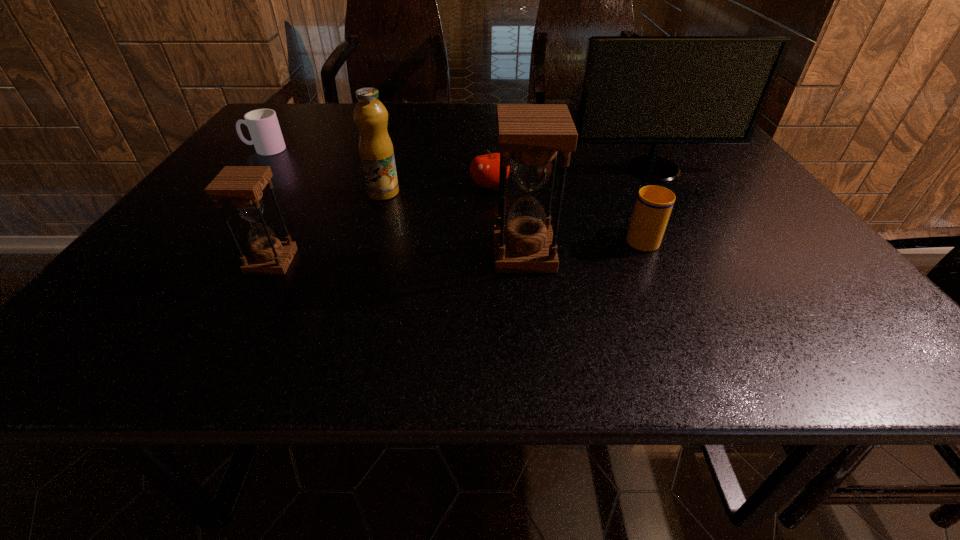
You are a GUI agent. You are given a task and a screenshot of the screen. Output one action in this format:
    pyautogui.click(x=<x>, y=<y>)
    Task: Click on the second object from left to right
    
    Given the screenshot: What is the action you would take?
    pyautogui.click(x=242, y=185)

The height and width of the screenshot is (540, 960). I want to click on the shorter hourglass, so click(x=242, y=185).

Locate an element on the screen. This screenshot has width=960, height=540. the taller hourglass is located at coordinates (531, 135).

This screenshot has width=960, height=540. I want to click on apple, so click(485, 169).

What are the coordinates of `the farther cup` in the screenshot? It's located at (263, 125).

The height and width of the screenshot is (540, 960). I want to click on the leftmost object, so click(263, 125).

Where is `fruit juice`? Image resolution: width=960 pixels, height=540 pixels. fruit juice is located at coordinates (376, 151).

Locate an element on the screen. The width and height of the screenshot is (960, 540). the third object from left to right is located at coordinates (376, 151).

Locate an element on the screen. Image resolution: width=960 pixels, height=540 pixels. computer monitor is located at coordinates (655, 90).

I want to click on the right cup, so click(653, 206).